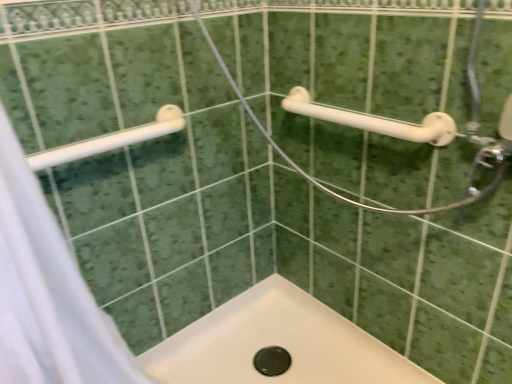
Question: Can we say white plastic towel rack at upper left, positioned as the 1th towel rack in left-to-right order, lies outside white fabric shower curtain at left?

Choices:
 (A) yes
 (B) no

Answer: (B)

Question: Can you confirm if white plastic towel rack at upper left, the 2th towel rack viewed from the right, is positioned to the left of white fabric shower curtain at left?

Choices:
 (A) no
 (B) yes

Answer: (A)

Question: From the image's perspective, does white plastic towel rack at upper left, positioned as the 1th towel rack in left-to-right order, appear lower than white fabric shower curtain at left?

Choices:
 (A) yes
 (B) no

Answer: (B)

Question: Is the position of white plastic towel rack at upper left, positioned as the 1th towel rack in left-to-right order, more distant than that of white fabric shower curtain at left?

Choices:
 (A) no
 (B) yes

Answer: (B)

Question: Considering the relative sizes of white plastic towel rack at upper left, positioned as the 1th towel rack in left-to-right order, and white fabric shower curtain at left in the image provided, is white plastic towel rack at upper left, positioned as the 1th towel rack in left-to-right order, thinner than white fabric shower curtain at left?

Choices:
 (A) yes
 (B) no

Answer: (A)

Question: From a real-world perspective, relative to white plastic grab bar at upper right, placed as the 2th towel rack when sorted from left to right, is white fabric shower curtain at left vertically above or below?

Choices:
 (A) above
 (B) below

Answer: (B)

Question: In the image, is white fabric shower curtain at left on the left side or the right side of white plastic grab bar at upper right, acting as the first towel rack starting from the right?

Choices:
 (A) left
 (B) right

Answer: (A)

Question: Considering the positions of white fabric shower curtain at left and white plastic grab bar at upper right, acting as the first towel rack starting from the right, in the image, is white fabric shower curtain at left taller or shorter than white plastic grab bar at upper right, acting as the first towel rack starting from the right,?

Choices:
 (A) tall
 (B) short

Answer: (A)

Question: Does point (123, 372) appear closer or farther from the camera than point (283, 104)?

Choices:
 (A) farther
 (B) closer

Answer: (B)

Question: Is point (86, 345) closer or farther from the camera than point (131, 135)?

Choices:
 (A) closer
 (B) farther

Answer: (B)

Question: Choose the correct answer: Is white fabric shower curtain at left inside white plastic towel rack at upper left, the 2th towel rack viewed from the right, or outside it?

Choices:
 (A) inside
 (B) outside

Answer: (B)

Question: From the image's perspective, relative to white plastic towel rack at upper left, positioned as the 1th towel rack in left-to-right order, is white fabric shower curtain at left above or below?

Choices:
 (A) below
 (B) above

Answer: (A)

Question: In the image, is white fabric shower curtain at left on the left side or the right side of white plastic towel rack at upper left, positioned as the 1th towel rack in left-to-right order?

Choices:
 (A) right
 (B) left

Answer: (B)

Question: In terms of width, does white plastic grab bar at upper right, placed as the 2th towel rack when sorted from left to right, look wider or thinner when compared to white fabric shower curtain at left?

Choices:
 (A) thin
 (B) wide

Answer: (A)

Question: Is white plastic grab bar at upper right, acting as the first towel rack starting from the right, in front of or behind white fabric shower curtain at left in the image?

Choices:
 (A) front
 (B) behind

Answer: (B)